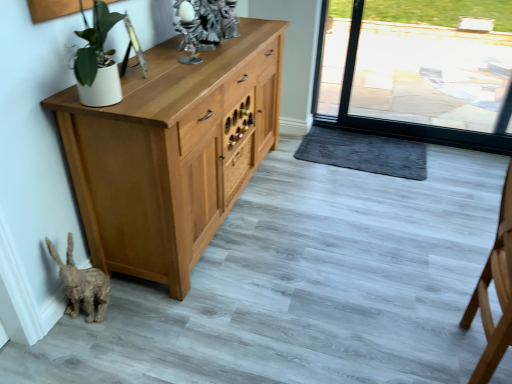
What do you see at coordinates (237, 167) in the screenshot? This screenshot has width=512, height=384. I see `wooden drawer at center` at bounding box center [237, 167].

This screenshot has width=512, height=384. Describe the element at coordinates (496, 292) in the screenshot. I see `light brown wooden chair at right` at that location.

Identify the location of wooden drawer at center. The height and width of the screenshot is (384, 512). (237, 167).

Between dark gray plush doormat at lower center and wooden drawer at center, which one is positioned behind?

dark gray plush doormat at lower center is more distant.

From the image's perspective, which one is positioned lower, dark gray plush doormat at lower center or wooden drawer at center?

wooden drawer at center is shown below in the image.

Does point (383, 158) come closer to viewer compared to point (253, 158)?

No, it is behind (253, 158).

Considering the points (503, 242) and (314, 144), which point is in front, point (503, 242) or point (314, 144)?

The point (503, 242) is more forward.

Find the location of `doormat lying behind the light brown wooden chair at right`. doormat lying behind the light brown wooden chair at right is located at coordinates (364, 153).

Considering the relative sizes of light brown wooden chair at right and dark gray plush doormat at lower center in the image provided, is light brown wooden chair at right wider than dark gray plush doormat at lower center?

In fact, light brown wooden chair at right might be narrower than dark gray plush doormat at lower center.

From a real-world perspective, between light brown wooden chair at right and dark gray plush doormat at lower center, who is vertically higher?

From a 3D spatial view, light brown wooden chair at right is above.

Based on their positions, is dark gray plush doormat at lower center located to the left or right of light brown wooden chair at right?

From the image, it's evident that dark gray plush doormat at lower center is to the left of light brown wooden chair at right.

Who is more distant, dark gray plush doormat at lower center or light brown wooden chair at right?

dark gray plush doormat at lower center is behind.

Between point (353, 149) and point (502, 347), which one is positioned behind?

The point (353, 149) is farther.

What's the angular difference between dark gray plush doormat at lower center and light brown wooden chair at right's facing directions?

90.3 degrees.

Is wooden drawer at center to the right of dark gray plush doormat at lower center from the viewer's perspective?

In fact, wooden drawer at center is to the left of dark gray plush doormat at lower center.

Considering the sizes of wooden drawer at center and dark gray plush doormat at lower center in the image, is wooden drawer at center bigger or smaller than dark gray plush doormat at lower center?

In the image, wooden drawer at center appears to be smaller than dark gray plush doormat at lower center.

From a real-world perspective, between wooden drawer at center and dark gray plush doormat at lower center, who is vertically lower?

In real-world perspective, dark gray plush doormat at lower center is lower.

Which object is closer to the camera taking this photo, wooden drawer at center or dark gray plush doormat at lower center?

wooden drawer at center is more forward.

Which object is positioned more to the left, light brown wooden chair at right or wooden drawer at center?

Positioned to the left is wooden drawer at center.

Can you confirm if light brown wooden chair at right is shorter than wooden drawer at center?

In fact, light brown wooden chair at right may be taller than wooden drawer at center.

From a real-world perspective, who is located lower, light brown wooden chair at right or wooden drawer at center?

In real-world perspective, wooden drawer at center is lower.

Considering the positions of points (242, 170) and (502, 270), is point (242, 170) closer to camera compared to point (502, 270)?

No, it is not.

Locate an element on the screen. The width and height of the screenshot is (512, 384). chair lying on the right of wooden drawer at center is located at coordinates (496, 292).

Is wooden drawer at center inside or outside of light brown wooden chair at right?

wooden drawer at center exists outside the volume of light brown wooden chair at right.

From a real-world perspective, who is located higher, wooden drawer at center or light brown wooden chair at right?

light brown wooden chair at right.

The height and width of the screenshot is (384, 512). Identify the location of doormat located above the wooden drawer at center (from the image's perspective). (364, 153).

Image resolution: width=512 pixels, height=384 pixels. What are the coordinates of `chair that appears in front of the dark gray plush doormat at lower center` in the screenshot? It's located at (496, 292).

Considering their positions, is dark gray plush doormat at lower center positioned further to wooden drawer at center than light brown wooden chair at right?

light brown wooden chair at right is positioned further to the anchor wooden drawer at center.

Estimate the real-world distances between objects in this image. Which object is further from dark gray plush doormat at lower center, wooden drawer at center or light brown wooden chair at right?

light brown wooden chair at right.

From the image, which object appears to be nearer to wooden drawer at center, light brown wooden chair at right or dark gray plush doormat at lower center?

dark gray plush doormat at lower center is positioned closer to the anchor wooden drawer at center.

Based on their spatial positions, is wooden drawer at center or dark gray plush doormat at lower center further from light brown wooden chair at right?

wooden drawer at center is further to light brown wooden chair at right.

From the image, which object appears to be nearer to dark gray plush doormat at lower center, light brown wooden chair at right or wooden drawer at center?

wooden drawer at center lies closer to dark gray plush doormat at lower center than the other object.

When comparing their distances from light brown wooden chair at right, does dark gray plush doormat at lower center or wooden drawer at center seem closer?

dark gray plush doormat at lower center lies closer to light brown wooden chair at right than the other object.

This screenshot has width=512, height=384. I want to click on drawer between light brown wooden chair at right and dark gray plush doormat at lower center along the z-axis, so click(x=237, y=167).